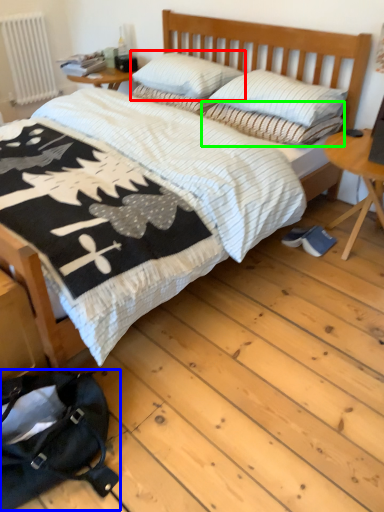
Question: Estimate the real-world distances between objects in this image. Which object is farther from pillow (highlighted by a red box), messenger bag (highlighted by a blue box) or pillow (highlighted by a green box)?

Choices:
 (A) messenger bag
 (B) pillow

Answer: (A)